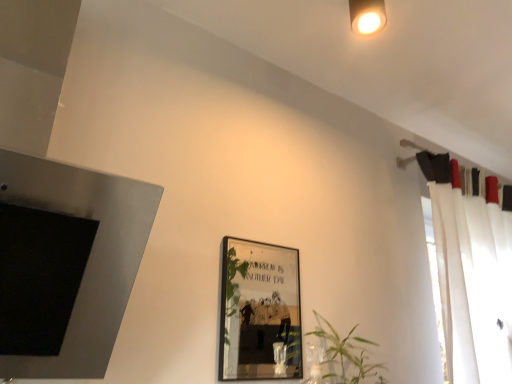
Question: In terms of width, does white sheer curtain at right look wider or thinner when compared to matte black fireplace at left?

Choices:
 (A) thin
 (B) wide

Answer: (A)

Question: From the image's perspective, relative to matte black fireplace at left, is white sheer curtain at right above or below?

Choices:
 (A) above
 (B) below

Answer: (B)

Question: Estimate the real-world distances between objects in this image. Which object is farther from the white sheer curtain at right?

Choices:
 (A) matte black fireplace at left
 (B) green leafy plant at center
 (C) metallic silver picture frame at center

Answer: (C)

Question: Considering the real-world distances, which object is farthest from the matte black fireplace at left?

Choices:
 (A) white sheer curtain at right
 (B) metallic silver picture frame at center
 (C) green leafy plant at center

Answer: (B)